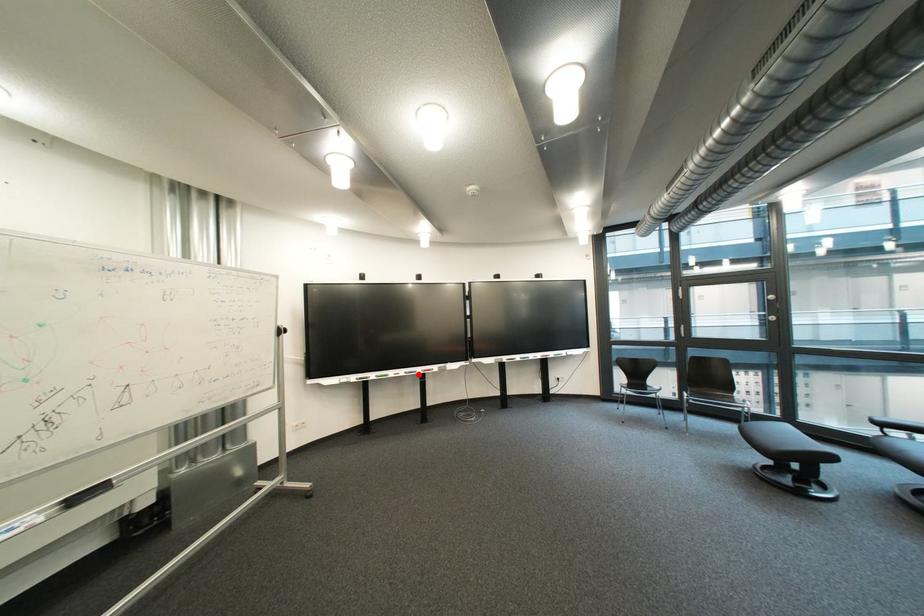
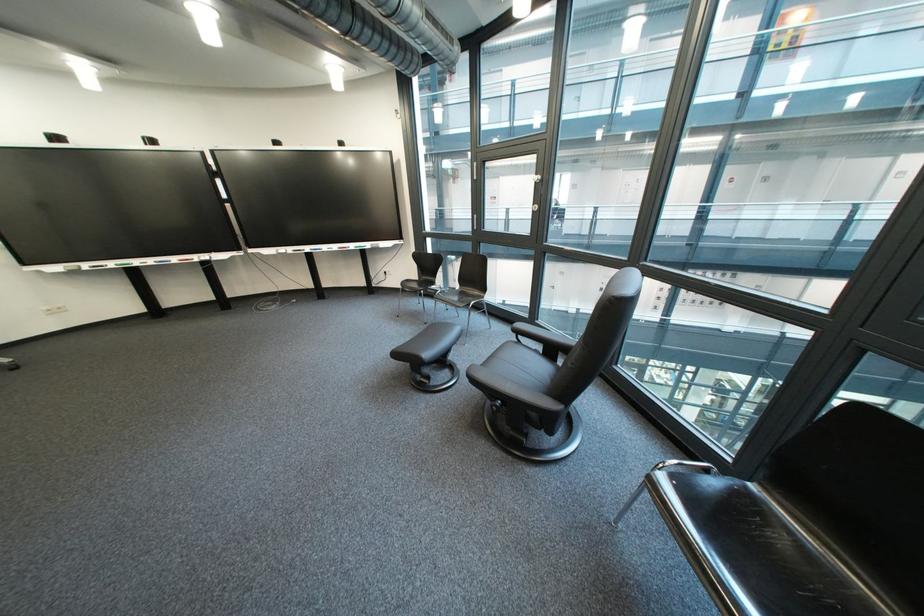
In the second image, find the point that corresponds to the highlighted location in the first image.

(169, 264)